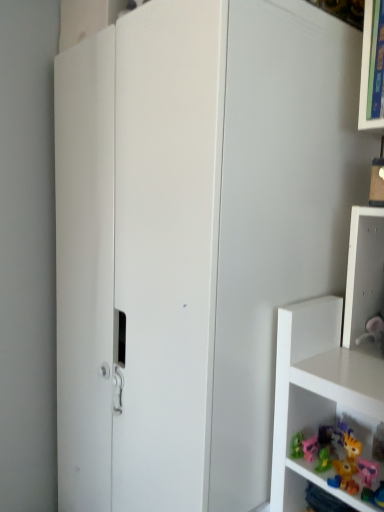
The image size is (384, 512). Find the location of `pink plastic toy at lower right`. pink plastic toy at lower right is located at coordinates (310, 448).

This screenshot has height=512, width=384. What do you see at coordinates (310, 448) in the screenshot? I see `pink plastic toy at lower right` at bounding box center [310, 448].

What do you see at coordinates (363, 272) in the screenshot? Image resolution: width=384 pixels, height=512 pixels. I see `white plastic shelf at right` at bounding box center [363, 272].

This screenshot has height=512, width=384. I want to click on white plastic shelf at right, so click(363, 272).

What is the approximate height of white plastic shelf at right?

It is 7.70 inches.

At what (x,y) coordinates should I click in order to perform the action: click on pink plastic toy at lower right. Please return your answer as a coordinate pair (x, y). The image size is (384, 512). Looking at the image, I should click on (310, 448).

Considering the positions of objects white plastic shelf at right and pink plastic toy at lower right in the image provided, who is more to the right, white plastic shelf at right or pink plastic toy at lower right?

white plastic shelf at right.

Considering their positions, is white plastic shelf at right located in front of or behind pink plastic toy at lower right?

white plastic shelf at right is positioned closer to the viewer than pink plastic toy at lower right.

Does point (372, 288) come farther from viewer compared to point (316, 435)?

Yes, it is behind point (316, 435).

From the image's perspective, is white plastic shelf at right located above pink plastic toy at lower right?

Indeed, from the image's perspective, white plastic shelf at right is shown above pink plastic toy at lower right.

From a real-world perspective, is white plastic shelf at right located higher than pink plastic toy at lower right?

Correct, in the physical world, white plastic shelf at right is higher than pink plastic toy at lower right.

Considering the sizes of objects white plastic shelf at right and pink plastic toy at lower right in the image provided, who is wider, white plastic shelf at right or pink plastic toy at lower right?

Wider between the two is white plastic shelf at right.

From their relative heights in the image, would you say white plastic shelf at right is taller or shorter than pink plastic toy at lower right?

white plastic shelf at right is taller than pink plastic toy at lower right.

Can you confirm if white plastic shelf at right is bigger than pink plastic toy at lower right?

Yes.

Is white plastic shelf at right outside of pink plastic toy at lower right?

Yes.

From the picture: Is white plastic shelf at right not near pink plastic toy at lower right?

They are positioned close to each other.

Is white plastic shelf at right turned away from pink plastic toy at lower right?

That's not correct — white plastic shelf at right is not looking away from pink plastic toy at lower right.

How different are the orientations of white plastic shelf at right and pink plastic toy at lower right in degrees?

2.34 degrees.

Measure the distance from white plastic shelf at right to pink plastic toy at lower right.

white plastic shelf at right and pink plastic toy at lower right are 12.17 inches apart.

Identify the location of toy below the white plastic shelf at right (from the image's perspective). (310, 448).

Considering the positions of objects pink plastic toy at lower right and white plastic shelf at right in the image provided, who is more to the right, pink plastic toy at lower right or white plastic shelf at right?

white plastic shelf at right.

Is pink plastic toy at lower right in front of white plastic shelf at right?

No, pink plastic toy at lower right is further to the viewer.

Which is closer to the camera, (312, 447) or (362, 255)?

Point (312, 447) is positioned closer to the camera compared to point (362, 255).

In the scene shown: From the image's perspective, relative to white plastic shelf at right, is pink plastic toy at lower right above or below?

pink plastic toy at lower right is situated lower than white plastic shelf at right in the image.

From a real-world perspective, does pink plastic toy at lower right sit lower than white plastic shelf at right?

Yes, from a real-world perspective, pink plastic toy at lower right is beneath white plastic shelf at right.

From the picture: Considering the sizes of pink plastic toy at lower right and white plastic shelf at right in the image, is pink plastic toy at lower right wider or thinner than white plastic shelf at right?

Clearly, pink plastic toy at lower right has less width compared to white plastic shelf at right.

Is pink plastic toy at lower right shorter than white plastic shelf at right?

Correct, pink plastic toy at lower right is not as tall as white plastic shelf at right.

Can you confirm if pink plastic toy at lower right is smaller than white plastic shelf at right?

Correct, pink plastic toy at lower right occupies less space than white plastic shelf at right.

Can we say pink plastic toy at lower right lies outside white plastic shelf at right?

That's correct, pink plastic toy at lower right is outside of white plastic shelf at right.

Is pink plastic toy at lower right not close to white plastic shelf at right?

They are positioned close to each other.

Could you tell me if pink plastic toy at lower right is facing white plastic shelf at right?

No, pink plastic toy at lower right does not turn towards white plastic shelf at right.

Consider the image. How different are the orientations of pink plastic toy at lower right and white plastic shelf at right in degrees?

They differ by 2.34 degrees in their facing directions.

You are a GUI agent. You are given a task and a screenshot of the screen. Output one action in this format:
    pyautogui.click(x=<x>, y=<y>)
    Task: Click on the toy below the white plastic shelf at right (from a real-world perspective)
    The height and width of the screenshot is (512, 384).
    Given the screenshot: What is the action you would take?
    pyautogui.click(x=310, y=448)

This screenshot has width=384, height=512. In the image, there is a white plastic shelf at right. Identify the location of toy below it (from a real-world perspective). (310, 448).

Find the location of `shelf on the right of pink plastic toy at lower right`. shelf on the right of pink plastic toy at lower right is located at coordinates (363, 272).